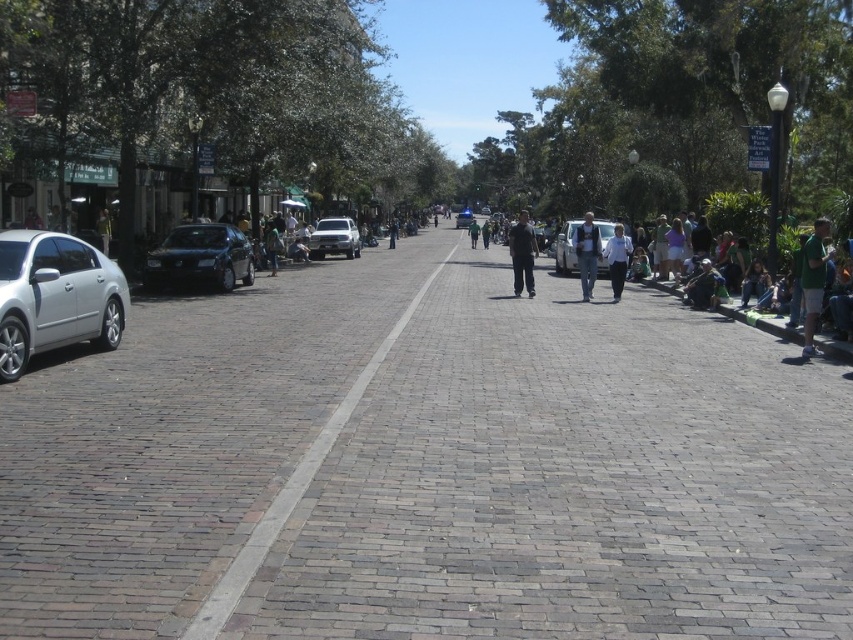
Is point (801, 269) less distant than point (561, 262)?

Yes, point (801, 269) is in front of point (561, 262).

Can you confirm if green fabric shirt at right is taller than white matte car at center?

Incorrect, green fabric shirt at right's height is not larger of white matte car at center's.

At what (x,y) coordinates should I click in order to perform the action: click on green fabric shirt at right. Please return your answer as a coordinate pair (x, y). Looking at the image, I should click on (813, 280).

The image size is (853, 640). I want to click on brick road at center, so click(292, 490).

Does brick road at center have a greater height compared to silver metallic truck at center?

In fact, brick road at center may be shorter than silver metallic truck at center.

The width and height of the screenshot is (853, 640). In order to click on brick road at center in this screenshot , I will do `click(292, 490)`.

Can you confirm if brick pavement at center is thinner than dark gray pants at center?

No, brick pavement at center is not thinner than dark gray pants at center.

How much distance is there between brick pavement at center and dark gray pants at center?

brick pavement at center and dark gray pants at center are 9.25 meters apart from each other.

What do you see at coordinates (428, 465) in the screenshot? The height and width of the screenshot is (640, 853). I see `brick pavement at center` at bounding box center [428, 465].

Locate an element on the screen. This screenshot has height=640, width=853. brick pavement at center is located at coordinates (428, 465).